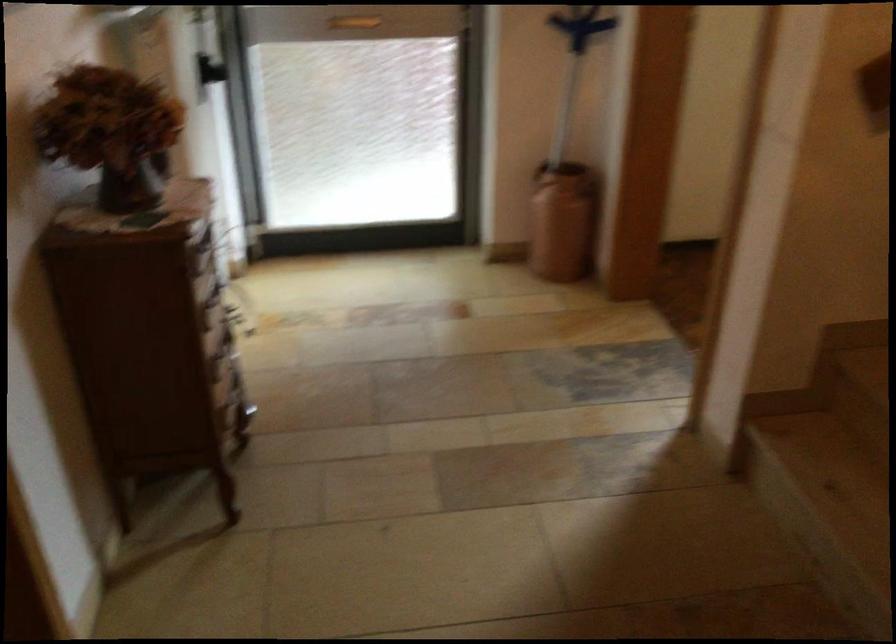
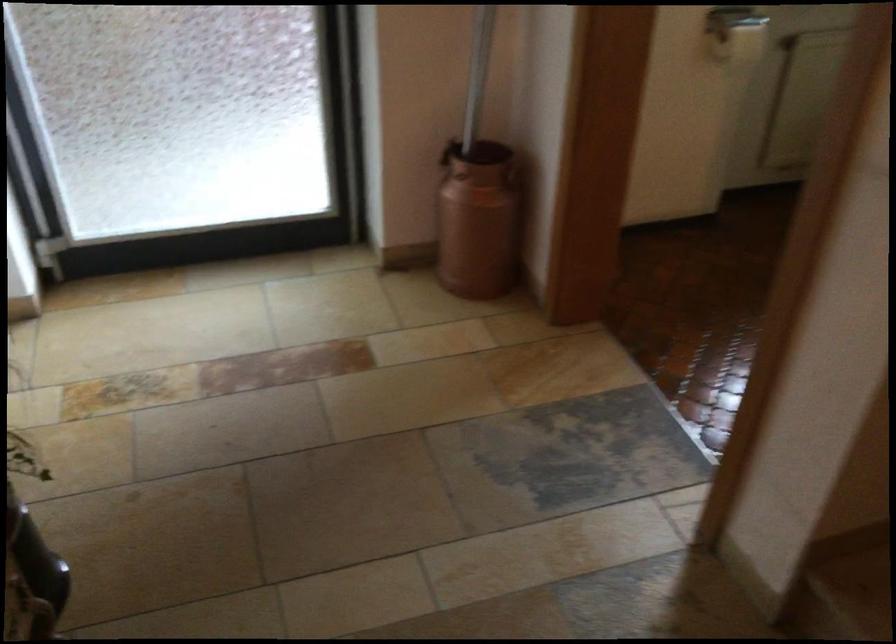
Question: What movement of the cameraman would produce the second image?

Choices:
 (A) Left
 (B) Right
 (C) Forward
 (D) Backward

Answer: (C)